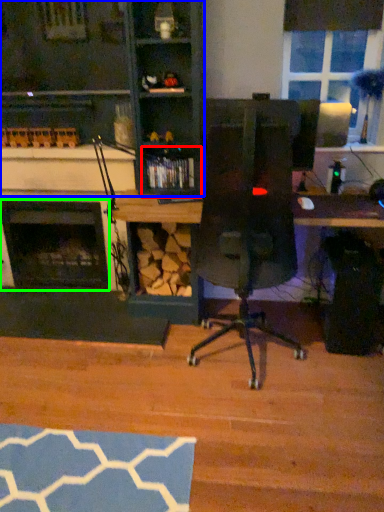
Question: Which object is the farthest from shelf (highlighted by a red box)? Choose among these: cabinetry (highlighted by a blue box) or fireplace (highlighted by a green box).

Choices:
 (A) cabinetry
 (B) fireplace

Answer: (B)